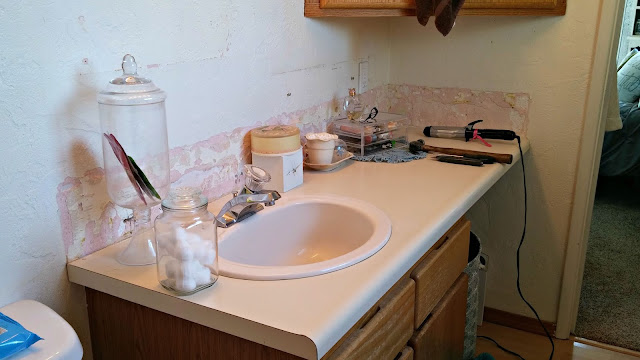
What are the coordinates of `drawers` in the screenshot? It's located at pos(390,321), pos(445,299), pos(444,324), pos(406,353).